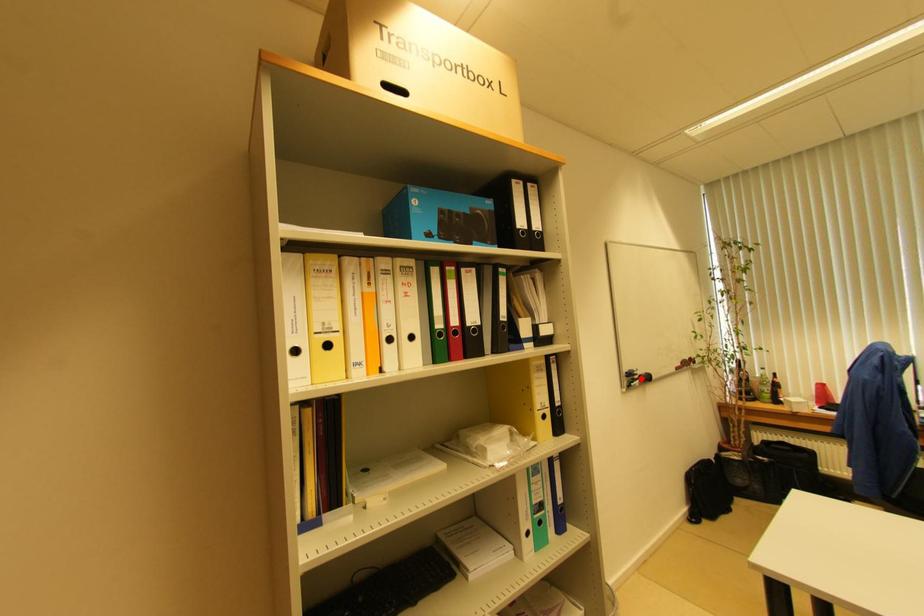
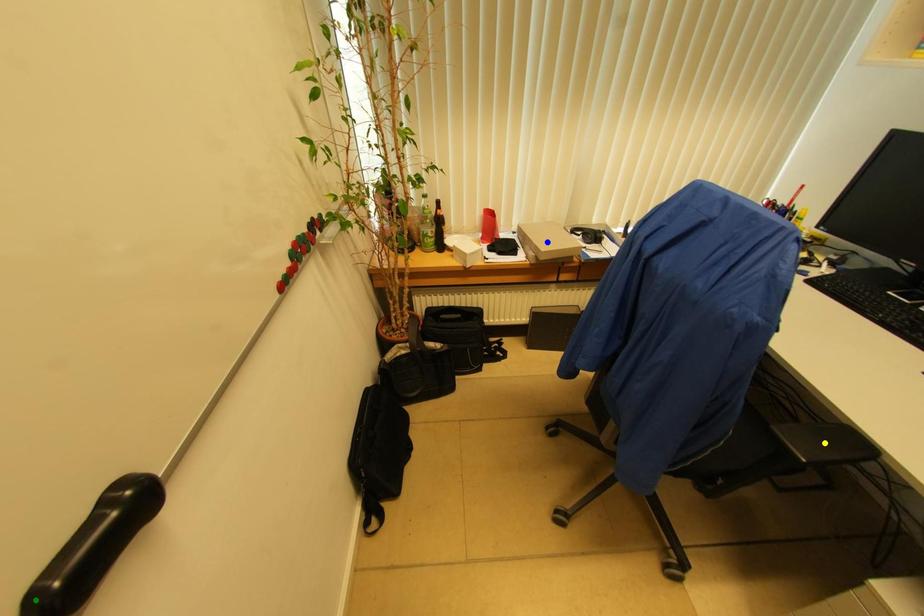
Question: I am providing you with two images of the same scene from different viewpoints. A red point is marked on the first image. You are given multiple points on the second image. Which point in image 2 represents the same 3d spot as the red point in image 1?

Choices:
 (A) green point
 (B) blue point
 (C) yellow point

Answer: (A)